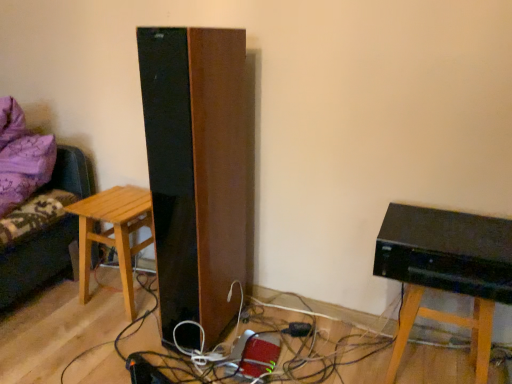
This screenshot has width=512, height=384. Find the location of `free location to the left of light brown wooden stool at left`. free location to the left of light brown wooden stool at left is located at coordinates (61, 299).